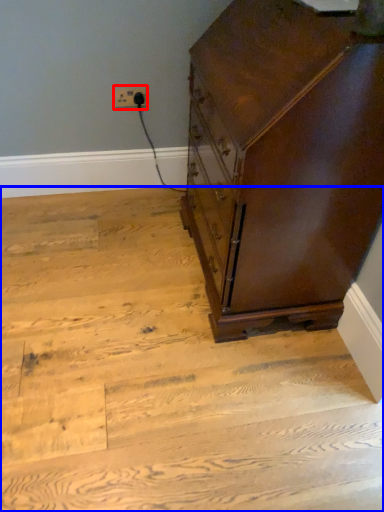
Question: Among these objects, which one is nearest to the camera, electric outlet (highlighted by a red box) or stairwell (highlighted by a blue box)?

Choices:
 (A) electric outlet
 (B) stairwell

Answer: (B)